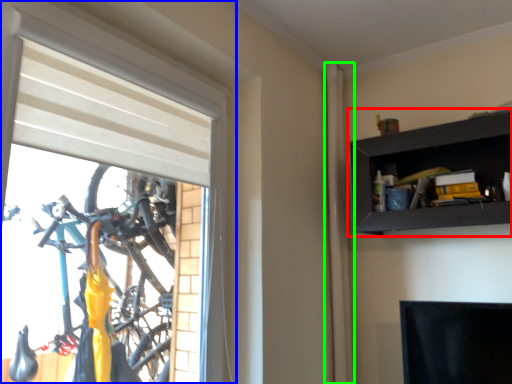
Question: Based on their relative distances, which object is nearer to shelf (highlighted by a red box)? Choose from window (highlighted by a blue box) and curtain (highlighted by a green box).

Choices:
 (A) window
 (B) curtain

Answer: (B)